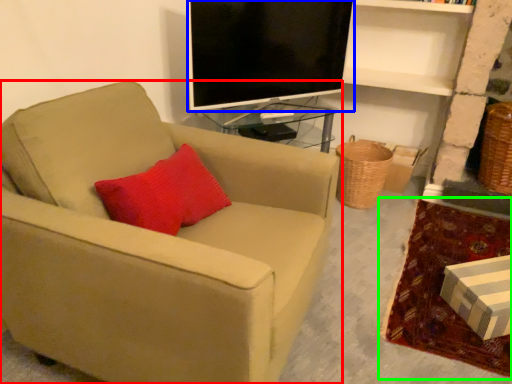
Question: Considering the real-world distances, which object is farthest from chair (highlighted by a red box)? television (highlighted by a blue box) or plain (highlighted by a green box)?

Choices:
 (A) television
 (B) plain

Answer: (B)